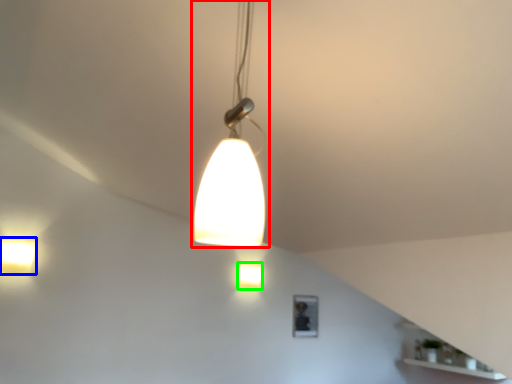
Question: Which object is positioned farthest from lamp (highlighted by a red box)? Select from lamp (highlighted by a blue box) and lamp (highlighted by a green box).

Choices:
 (A) lamp
 (B) lamp

Answer: (B)